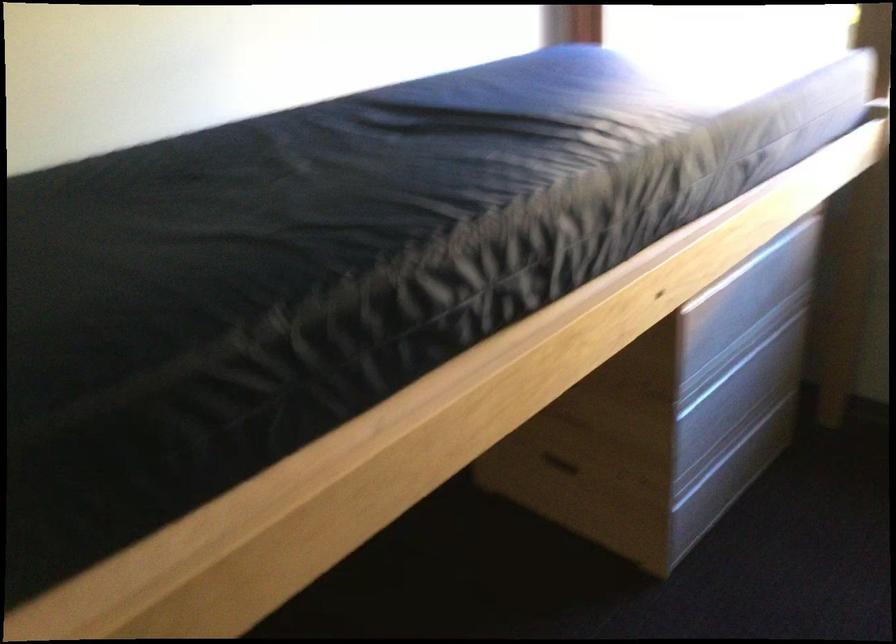
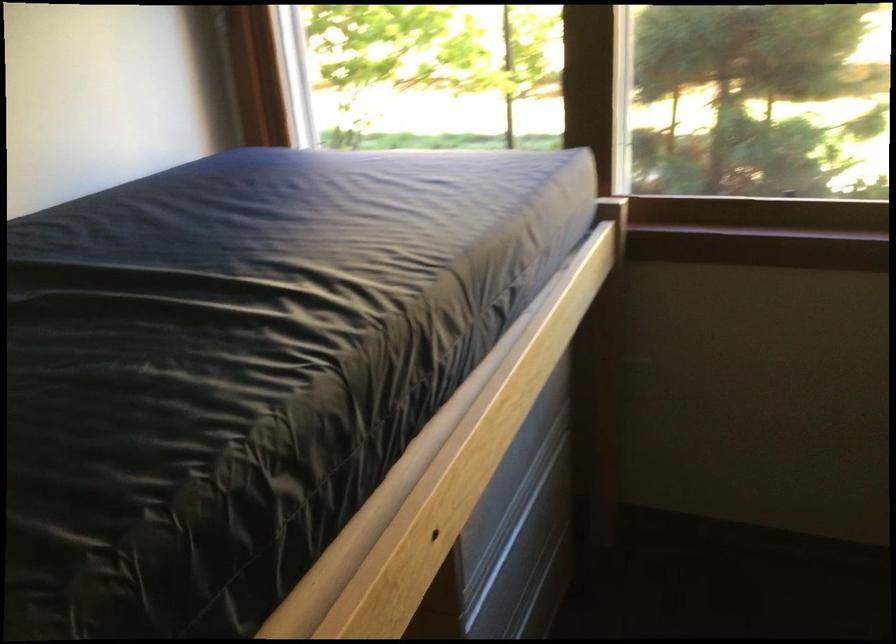
Question: In a continuous first-person perspective shot, in which direction is the camera moving?

Choices:
 (A) Left
 (B) Right
 (C) Forward
 (D) Backward

Answer: (C)